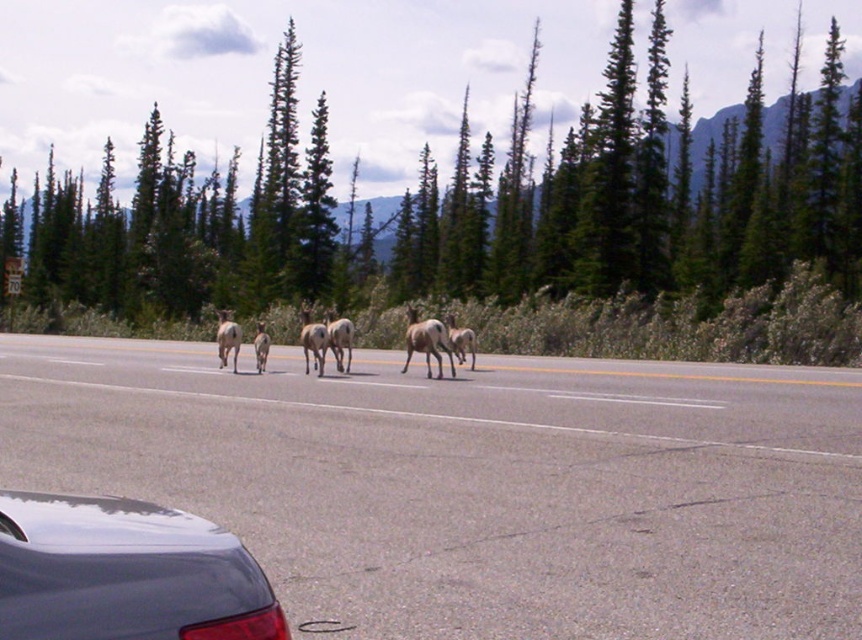
Question: Which of the following is the closest to the observer?

Choices:
 (A) (597, 380)
 (B) (38, 611)

Answer: (B)

Question: Where is gray asphalt highway at center located in relation to glossy dark blue car at lower left in the image?

Choices:
 (A) below
 (B) above

Answer: (A)

Question: Does gray asphalt highway at center appear over glossy dark blue car at lower left?

Choices:
 (A) no
 (B) yes

Answer: (A)

Question: From the image, what is the correct spatial relationship of gray asphalt highway at center in relation to glossy dark blue car at lower left?

Choices:
 (A) above
 (B) below

Answer: (B)

Question: Which of the following is the farthest from the observer?

Choices:
 (A) (84, 634)
 (B) (255, 392)

Answer: (B)